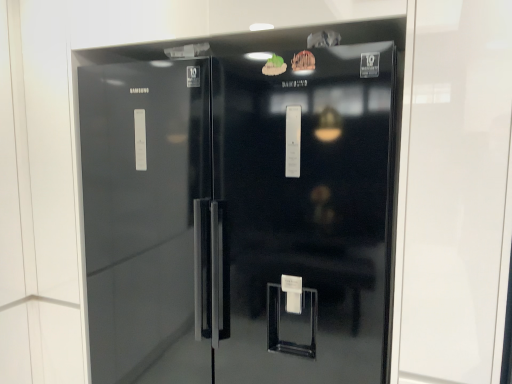
In order to face green matte food at upper center, which appears as the first food when viewed from the left, should I rotate leftwards or rightwards?

You should rotate right by 2.520 degrees.

How much space does wooden carving at upper center, acting as the first food starting from the right, occupy vertically?

wooden carving at upper center, acting as the first food starting from the right, is 6.70 centimeters in height.

What is the approximate width of wooden carving at upper center, acting as the first food starting from the right?

It is 1.08 centimeters.

Find the location of a particular element. The height and width of the screenshot is (384, 512). green matte food at upper center, the second food from the right is located at coordinates [x=274, y=66].

Considering their positions, is green matte food at upper center, the second food from the right, located in front of or behind wooden carving at upper center, acting as the first food starting from the right?

Visually, green matte food at upper center, the second food from the right, is located behind wooden carving at upper center, acting as the first food starting from the right.

The image size is (512, 384). Identify the location of food that is above the wooden carving at upper center, positioned as the 2th food in left-to-right order (from the image's perspective). (274, 66).

Does green matte food at upper center, which appears as the first food when viewed from the left, turn towards wooden carving at upper center, acting as the first food starting from the right?

No, green matte food at upper center, which appears as the first food when viewed from the left, is not turned towards wooden carving at upper center, acting as the first food starting from the right.

From a real-world perspective, is green matte food at upper center, the second food from the right, positioned over glossy black refrigerator at center based on gravity?

Yes, from a real-world perspective, green matte food at upper center, the second food from the right, is above glossy black refrigerator at center.

From the image's perspective, which one is positioned higher, green matte food at upper center, the second food from the right, or glossy black refrigerator at center?

green matte food at upper center, the second food from the right, is shown above in the image.

Is green matte food at upper center, which appears as the first food when viewed from the left, surrounding glossy black refrigerator at center?

Actually, glossy black refrigerator at center is outside green matte food at upper center, which appears as the first food when viewed from the left.

In the scene shown: Is the position of green matte food at upper center, which appears as the first food when viewed from the left, more distant than that of glossy black refrigerator at center?

Yes.

Is wooden carving at upper center, positioned as the 2th food in left-to-right order, turned away from green matte food at upper center, which appears as the first food when viewed from the left?

wooden carving at upper center, positioned as the 2th food in left-to-right order, does not have its back to green matte food at upper center, which appears as the first food when viewed from the left.

Relative to green matte food at upper center, the second food from the right, is wooden carving at upper center, acting as the first food starting from the right, in front or behind?

Visually, wooden carving at upper center, acting as the first food starting from the right, is located in front of green matte food at upper center, the second food from the right.

From the image's perspective, which is above, wooden carving at upper center, acting as the first food starting from the right, or green matte food at upper center, which appears as the first food when viewed from the left?

green matte food at upper center, which appears as the first food when viewed from the left, appears higher in the image.

Which is more to the right, wooden carving at upper center, positioned as the 2th food in left-to-right order, or green matte food at upper center, the second food from the right?

wooden carving at upper center, positioned as the 2th food in left-to-right order.

Can you confirm if glossy black refrigerator at center is wider than green matte food at upper center, which appears as the first food when viewed from the left?

Yes, glossy black refrigerator at center is wider than green matte food at upper center, which appears as the first food when viewed from the left.

Considering the points (337, 226) and (277, 62), which point is behind, point (337, 226) or point (277, 62)?

The point (337, 226) is more distant.

Is glossy black refrigerator at center facing towards green matte food at upper center, which appears as the first food when viewed from the left?

Yes.

Is glossy black refrigerator at center taller than green matte food at upper center, which appears as the first food when viewed from the left?

Yes.

Is glossy black refrigerator at center with wooden carving at upper center, acting as the first food starting from the right?

No, glossy black refrigerator at center is not beside wooden carving at upper center, acting as the first food starting from the right.

From a real-world perspective, between glossy black refrigerator at center and wooden carving at upper center, positioned as the 2th food in left-to-right order, who is vertically lower?

glossy black refrigerator at center, from a real-world perspective.

Consider the image. Is wooden carving at upper center, acting as the first food starting from the right, surrounded by glossy black refrigerator at center?

Yes.

From a real-world perspective, which is physically below, wooden carving at upper center, positioned as the 2th food in left-to-right order, or glossy black refrigerator at center?

glossy black refrigerator at center.

This screenshot has width=512, height=384. What are the coordinates of `the 1st food behind the glossy black refrigerator at center, starting your count from the anchor` in the screenshot? It's located at (303, 61).

In terms of width, does wooden carving at upper center, acting as the first food starting from the right, look wider or thinner when compared to glossy black refrigerator at center?

wooden carving at upper center, acting as the first food starting from the right, is thinner than glossy black refrigerator at center.

You are a GUI agent. You are given a task and a screenshot of the screen. Output one action in this format:
    pyautogui.click(x=<x>, y=<y>)
    Task: Click on the food below the green matte food at upper center, the second food from the right (from the image's perspective)
    The image size is (512, 384).
    Given the screenshot: What is the action you would take?
    pyautogui.click(x=303, y=61)

From a real-world perspective, count 1st foods upward from the glossy black refrigerator at center and point to it. Please provide its 2D coordinates.

[(274, 66)]

Based on the photo, which object lies further to the anchor point glossy black refrigerator at center, green matte food at upper center, which appears as the first food when viewed from the left, or wooden carving at upper center, positioned as the 2th food in left-to-right order?

wooden carving at upper center, positioned as the 2th food in left-to-right order.

Looking at the image, which one is located further to green matte food at upper center, which appears as the first food when viewed from the left, glossy black refrigerator at center or wooden carving at upper center, acting as the first food starting from the right?

Based on the image, glossy black refrigerator at center appears to be further to green matte food at upper center, which appears as the first food when viewed from the left.

Considering their positions, is wooden carving at upper center, positioned as the 2th food in left-to-right order, positioned closer to green matte food at upper center, which appears as the first food when viewed from the left, than glossy black refrigerator at center?

Based on the image, wooden carving at upper center, positioned as the 2th food in left-to-right order, appears to be nearer to green matte food at upper center, which appears as the first food when viewed from the left.

From the image, which object appears to be farther from wooden carving at upper center, positioned as the 2th food in left-to-right order, green matte food at upper center, which appears as the first food when viewed from the left, or glossy black refrigerator at center?

glossy black refrigerator at center is positioned further to the anchor wooden carving at upper center, positioned as the 2th food in left-to-right order.

From the image, which object appears to be farther from glossy black refrigerator at center, wooden carving at upper center, positioned as the 2th food in left-to-right order, or green matte food at upper center, the second food from the right?

The object further to glossy black refrigerator at center is wooden carving at upper center, positioned as the 2th food in left-to-right order.

Looking at the image, which one is located closer to wooden carving at upper center, positioned as the 2th food in left-to-right order, glossy black refrigerator at center or green matte food at upper center, which appears as the first food when viewed from the left?

Among the two, green matte food at upper center, which appears as the first food when viewed from the left, is located nearer to wooden carving at upper center, positioned as the 2th food in left-to-right order.

The height and width of the screenshot is (384, 512). Identify the location of food between green matte food at upper center, which appears as the first food when viewed from the left, and glossy black refrigerator at center from top to bottom. (303, 61).